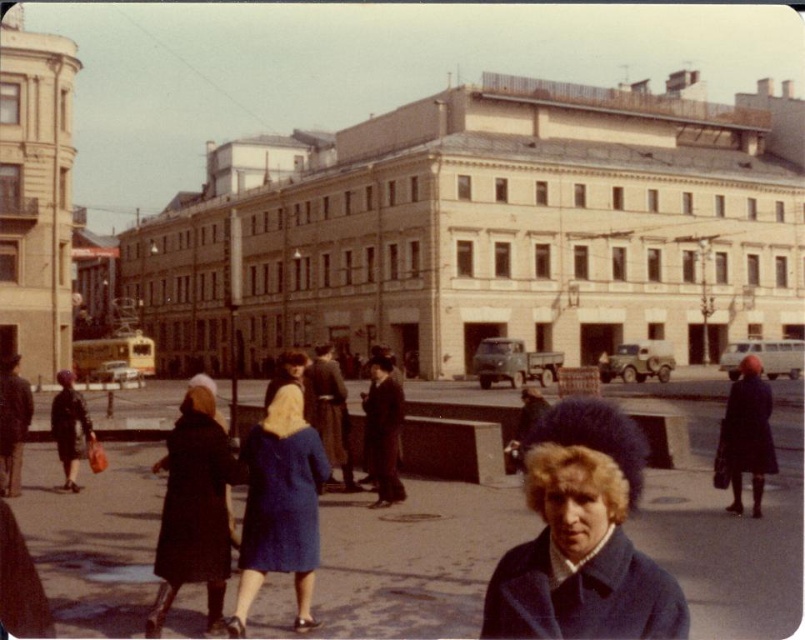
Is point (259, 426) closer to camera compared to point (205, 538)?

No, (259, 426) is behind (205, 538).

At what (x,y) coordinates should I click in order to perform the action: click on blue woolen coat at center. Please return your answer as a coordinate pair (x, y). Looking at the image, I should click on (279, 506).